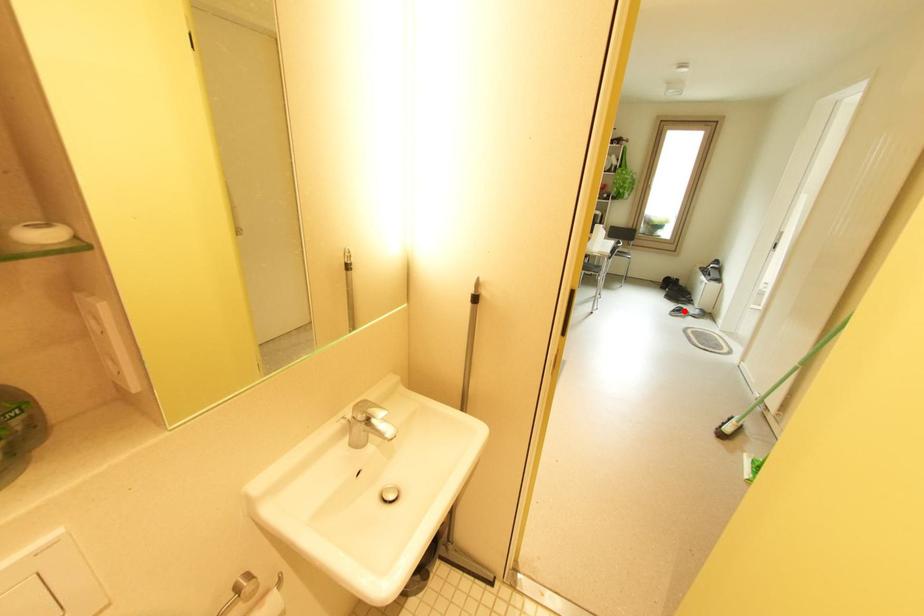
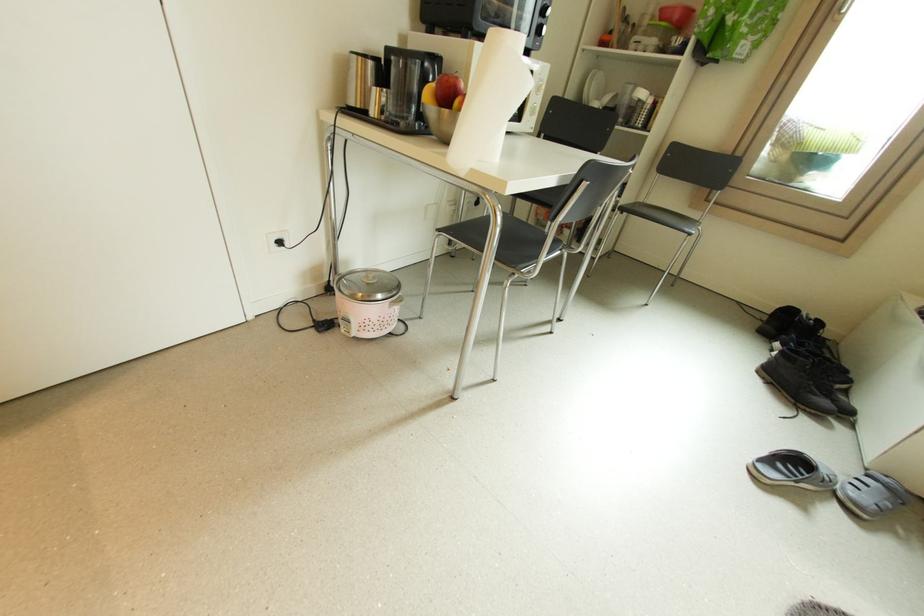
Find the pixel in the second image that matches the highlighted location in the first image.

(799, 463)